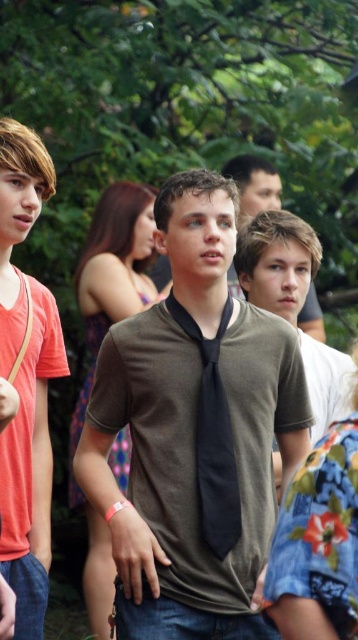
You are a photographer adjusting your camera settings to focus on the matte brown shirt at center and the black silk tie at center. Which object is closer to the camera lens?

The matte brown shirt at center is positioned over the black silk tie at center, so the matte brown shirt at center is closer to the camera lens.